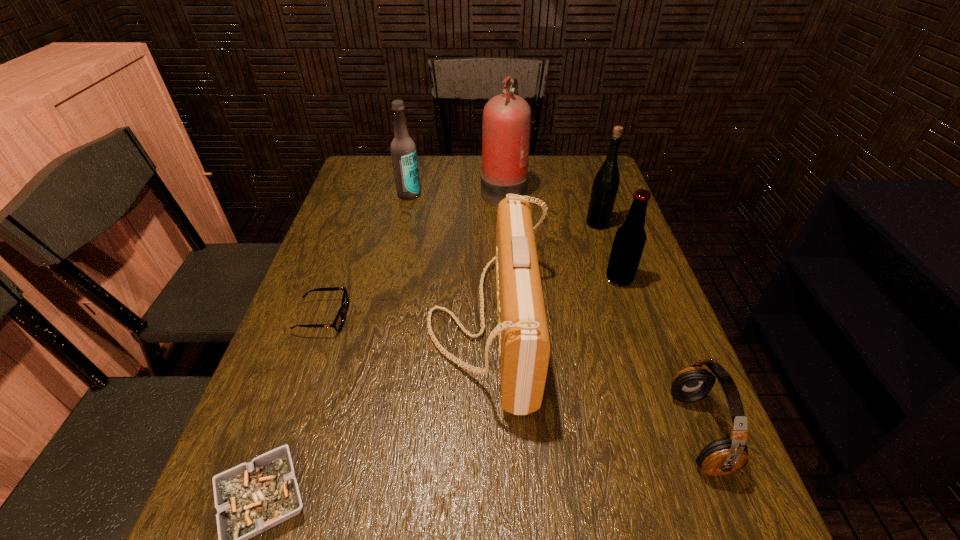
The height and width of the screenshot is (540, 960). I want to click on free space between the leftmost beer bottle and the handbag, so click(448, 259).

At what (x,y) coordinates should I click in order to perform the action: click on unoccupied position between the sixth tallest object and the sixth object from right to left. Please return your answer as a coordinate pair (x, y). Looking at the image, I should click on (554, 313).

Locate an element on the screen. free area in between the second farthest beer bottle and the shortest beer bottle is located at coordinates (609, 251).

In order to click on free spot between the shortest beer bottle and the fire extinguisher in this screenshot , I will do (562, 234).

This screenshot has width=960, height=540. Find the location of `free space that is in between the tallest object and the third farthest object`. free space that is in between the tallest object and the third farthest object is located at coordinates (550, 206).

The width and height of the screenshot is (960, 540). I want to click on the fourth closest object to the shortest object, so pyautogui.click(x=630, y=238).

Identify which object is located as the nearest to the shortest beer bottle. Please provide its 2D coordinates. Your answer should be formatted as a tuple, i.e. [(x, y)], where the tuple contains the x and y coordinates of a point satisfying the conditions above.

[(524, 345)]

Where is `the closest beer bottle relative to the shortest beer bottle`? the closest beer bottle relative to the shortest beer bottle is located at coordinates (606, 183).

You are a GUI agent. You are given a task and a screenshot of the screen. Output one action in this format:
    pyautogui.click(x=<x>, y=<y>)
    Task: Click on the beer bottle that is the second closest to the sixth tallest object
    
    Given the screenshot: What is the action you would take?
    pyautogui.click(x=606, y=183)

Image resolution: width=960 pixels, height=540 pixels. Find the location of `vacant space that satisfies the following two spatial constraints: 1. at the nozzle of the third farthest object; 2. on the right side of the fire extinguisher`. vacant space that satisfies the following two spatial constraints: 1. at the nozzle of the third farthest object; 2. on the right side of the fire extinguisher is located at coordinates (506, 224).